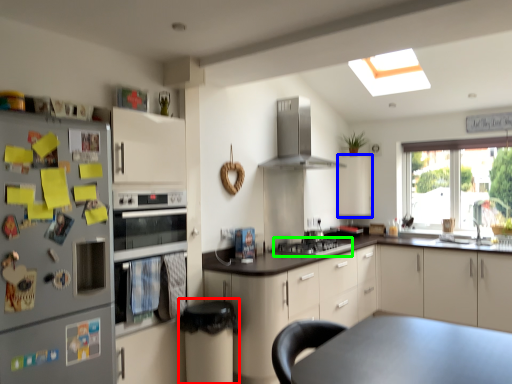
Question: Which object is positioned farthest from bar stool (highlighted by a red box)? Select from cabinetry (highlighted by a blue box) and gas stove (highlighted by a green box).

Choices:
 (A) cabinetry
 (B) gas stove

Answer: (A)